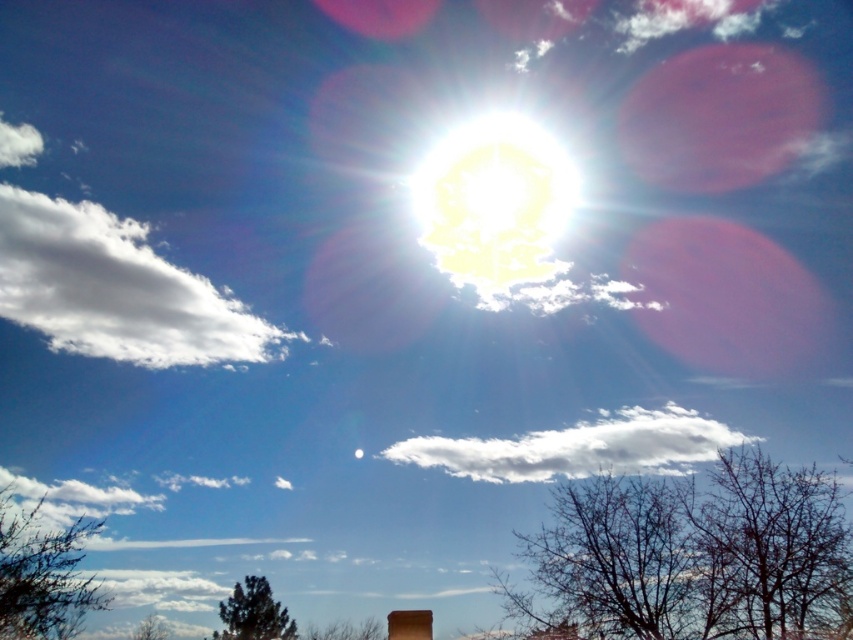
Looking at this image, you are standing in a field and see the green leafy tree at lower left and the white fluffy cloud at lower left in the sky. If you want to throw a ball to hit both objects, which one should you aim for first, the one closer to you or the one farther away?

The green leafy tree at lower left is closer to you than the white fluffy cloud at lower left, so you should aim for the green leafy tree at lower left first.

From the picture: You are observing the sky scene and want to determine which of the two points, point (606, 577) or point (96, 512), is closer to you. Based on the description, which point is nearer?

Point (606, 577) is closer to the viewer than point (96, 512).